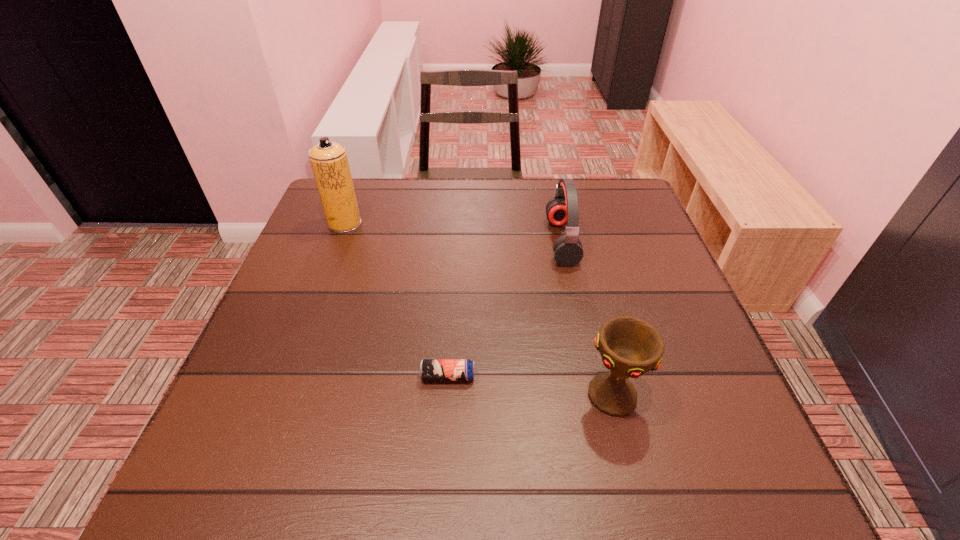
Image resolution: width=960 pixels, height=540 pixels. I want to click on free space located on the back of the chalice, so click(x=576, y=251).

You are a GUI agent. You are given a task and a screenshot of the screen. Output one action in this format:
    pyautogui.click(x=<x>, y=<y>)
    Task: Click on the free spot located 0.290m on the right of the beer can
    
    Given the screenshot: What is the action you would take?
    pyautogui.click(x=628, y=376)

Find the location of a particular element. This screenshot has width=960, height=540. aerosol can located at the far edge is located at coordinates pos(329,162).

Where is `earphone that is at the far edge`? The image size is (960, 540). earphone that is at the far edge is located at coordinates (563, 209).

The width and height of the screenshot is (960, 540). I want to click on object that is at the left edge, so click(329, 162).

Locate an element on the screen. The height and width of the screenshot is (540, 960). object present at the right edge is located at coordinates (630, 347).

This screenshot has width=960, height=540. I want to click on object that is at the far left corner, so click(329, 162).

In the image, there is a desktop. Identify the location of vacant space at the far edge. (467, 179).

In the image, there is a desktop. At what (x,y) coordinates should I click in order to perform the action: click on vacant space at the left edge. Please return your answer as a coordinate pair (x, y). This screenshot has height=540, width=960. Looking at the image, I should click on (312, 234).

Where is `vacant space at the right edge`? The image size is (960, 540). vacant space at the right edge is located at coordinates (721, 397).